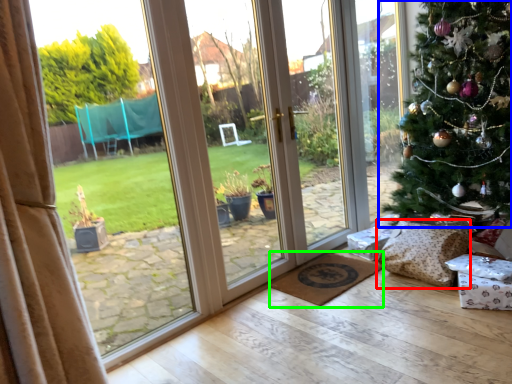
Question: Which object is the farthest from pillow (highlighted by a red box)? Choose among these: christmas tree (highlighted by a blue box) or doormat (highlighted by a green box).

Choices:
 (A) christmas tree
 (B) doormat

Answer: (A)